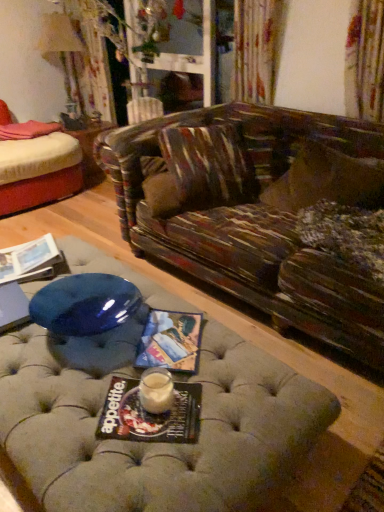
Describe the element at coordinates (89, 148) in the screenshot. This screenshot has height=512, width=384. I see `wooden side table at center` at that location.

Measure the distance between matte paper magazine at lower left, marked as the 1th magazine in a left-to-right arrangement, and camera.

matte paper magazine at lower left, marked as the 1th magazine in a left-to-right arrangement, and camera are 5.66 feet apart from each other.

Find the location of a particular element. This screenshot has width=384, height=512. fluffy brown pillow at right is located at coordinates (327, 180).

Between matte cream lampshade at upper left and matte black magazine at center, the third magazine when ordered from back to front, which one has smaller width?

matte black magazine at center, the third magazine when ordered from back to front.

Considering their positions, is matte cream lampshade at upper left located in front of or behind matte black magazine at center, arranged as the third magazine when viewed from the top?

Clearly, matte cream lampshade at upper left is behind matte black magazine at center, arranged as the third magazine when viewed from the top.

From the image's perspective, is matte cream lampshade at upper left located above or below matte black magazine at center, arranged as the third magazine when viewed from the top?

matte cream lampshade at upper left is above matte black magazine at center, arranged as the third magazine when viewed from the top.

Is matte cream lampshade at upper left far away from matte black magazine at center, which is the first magazine from front to back?

Indeed, matte cream lampshade at upper left is not near matte black magazine at center, which is the first magazine from front to back.

Which is in front, point (75, 40) or point (171, 339)?

Positioned in front is point (171, 339).

Is matte cream lampshade at upper left taller or shorter than matte paper magazine at center, acting as the 1th magazine starting from the right?

matte cream lampshade at upper left is taller than matte paper magazine at center, acting as the 1th magazine starting from the right.

Which of these two, matte cream lampshade at upper left or matte paper magazine at center, the 2th magazine in the bottom-to-top sequence, is smaller?

Smaller between the two is matte paper magazine at center, the 2th magazine in the bottom-to-top sequence.

Which object is wider, wooden side table at center or matte paper magazine at lower left, marked as the 1th magazine in a left-to-right arrangement?

wooden side table at center is wider.

The height and width of the screenshot is (512, 384). I want to click on magazine that is the 1st object located below the wooden side table at center (from the image's perspective), so click(x=28, y=258).

From a real-world perspective, is wooden side table at center beneath matte paper magazine at lower left, the 3th magazine ordered from the bottom?

Yes, from a real-world perspective, wooden side table at center is below matte paper magazine at lower left, the 3th magazine ordered from the bottom.

Between wooden side table at center and matte paper magazine at lower left, which is the first magazine from top to bottom, which one is positioned in front?

matte paper magazine at lower left, which is the first magazine from top to bottom, is in front.

From the image's perspective, which one is positioned higher, matte paper magazine at center, acting as the 1th magazine starting from the right, or wooden side table at center?

wooden side table at center, from the image's perspective.

Based on the photo, is matte paper magazine at center, the second magazine viewed from the front, oriented away from wooden side table at center?

Absolutely, matte paper magazine at center, the second magazine viewed from the front, is directed away from wooden side table at center.

Where is `side table above the matte paper magazine at center, which is the 3th magazine from left to right (from the image's perspective)`? This screenshot has height=512, width=384. side table above the matte paper magazine at center, which is the 3th magazine from left to right (from the image's perspective) is located at coordinates (89, 148).

Based on the photo, how many degrees apart are the facing directions of matte paper magazine at center, the 2th magazine in the bottom-to-top sequence, and wooden side table at center?

They differ by 51.7 degrees in their facing directions.

Looking at this image, which object is more forward, wooden side table at center or matte paper magazine at center, acting as the 1th magazine starting from the right?

matte paper magazine at center, acting as the 1th magazine starting from the right, is closer to the camera.

Is wooden side table at center located outside matte paper magazine at center, which ranks as the 2th magazine in top-to-bottom order?

Yes, wooden side table at center is located beyond the bounds of matte paper magazine at center, which ranks as the 2th magazine in top-to-bottom order.

From the image's perspective, which object appears higher, matte paper magazine at center, acting as the 1th magazine starting from the right, or fluffy brown pillow at right?

fluffy brown pillow at right appears higher in the image.

Considering the relative sizes of matte paper magazine at center, the second magazine viewed from the back, and fluffy brown pillow at right in the image provided, is matte paper magazine at center, the second magazine viewed from the back, shorter than fluffy brown pillow at right?

Yes, matte paper magazine at center, the second magazine viewed from the back, is shorter than fluffy brown pillow at right.

Between point (173, 320) and point (327, 164), which one is positioned behind?

Positioned behind is point (327, 164).

Considering the relative sizes of matte paper magazine at center, acting as the 1th magazine starting from the right, and fluffy brown pillow at right in the image provided, is matte paper magazine at center, acting as the 1th magazine starting from the right, wider than fluffy brown pillow at right?

No, matte paper magazine at center, acting as the 1th magazine starting from the right, is not wider than fluffy brown pillow at right.

Based on the photo, is fluffy brown pillow at right next to matte cream lampshade at upper left?

fluffy brown pillow at right and matte cream lampshade at upper left are not in contact.

From the image's perspective, is fluffy brown pillow at right above or below matte cream lampshade at upper left?

fluffy brown pillow at right is situated lower than matte cream lampshade at upper left in the image.

Looking at the image, does fluffy brown pillow at right seem bigger or smaller compared to matte cream lampshade at upper left?

Clearly, fluffy brown pillow at right is smaller in size than matte cream lampshade at upper left.

Find the location of `the 3rd magazine below the matte cream lampshade at upper left (from the image's perspective)`. the 3rd magazine below the matte cream lampshade at upper left (from the image's perspective) is located at coordinates (150, 414).

Starting from the matte cream lampshade at upper left, which magazine is the 2nd one in front? Please provide its 2D coordinates.

[(170, 341)]

Estimate the real-world distances between objects in this image. Which object is further from matte black magazine at center, acting as the 2th magazine starting from the left, wooden side table at center or matte paper magazine at center, which is the 3th magazine from left to right?

wooden side table at center is further to matte black magazine at center, acting as the 2th magazine starting from the left.

When comparing their distances from matte black magazine at center, which is the first magazine from front to back, does matte cream lampshade at upper left or matte paper magazine at center, acting as the 1th magazine starting from the right, seem further?

matte cream lampshade at upper left is further to matte black magazine at center, which is the first magazine from front to back.

Consider the image. Based on their spatial positions, is wooden side table at center or matte cream lampshade at upper left closer to matte black magazine at center, which appears as the second magazine when viewed from the right?

The object closer to matte black magazine at center, which appears as the second magazine when viewed from the right, is wooden side table at center.

When comparing their distances from matte black magazine at center, acting as the 2th magazine starting from the left, does matte cream lampshade at upper left or wooden side table at center seem further?

Among the two, matte cream lampshade at upper left is located further to matte black magazine at center, acting as the 2th magazine starting from the left.

When comparing their distances from matte black magazine at center, arranged as the third magazine when viewed from the top, does matte cream lampshade at upper left or fluffy brown pillow at right seem further?

matte cream lampshade at upper left is positioned further to the anchor matte black magazine at center, arranged as the third magazine when viewed from the top.

From the image, which object appears to be farther from fluffy brown pillow at right, matte black magazine at center, which is the first magazine from front to back, or matte paper magazine at center, the 2th magazine in the bottom-to-top sequence?

Based on the image, matte black magazine at center, which is the first magazine from front to back, appears to be further to fluffy brown pillow at right.

Looking at the image, which one is located further to matte black magazine at center, arranged as the third magazine when viewed from the top, matte paper magazine at lower left, the 3th magazine ordered from the bottom, or wooden side table at center?

Based on the image, wooden side table at center appears to be further to matte black magazine at center, arranged as the third magazine when viewed from the top.

Looking at the image, which one is located closer to matte paper magazine at lower left, which appears as the third magazine when viewed from the front, matte black magazine at center, arranged as the third magazine when viewed from the top, or matte paper magazine at center, the 2th magazine in the bottom-to-top sequence?

The object closer to matte paper magazine at lower left, which appears as the third magazine when viewed from the front, is matte paper magazine at center, the 2th magazine in the bottom-to-top sequence.

Where is `lamp between matte paper magazine at center, the second magazine viewed from the back, and wooden side table at center from front to back`? The image size is (384, 512). lamp between matte paper magazine at center, the second magazine viewed from the back, and wooden side table at center from front to back is located at coordinates (62, 51).

This screenshot has height=512, width=384. What are the coordinates of `side table between matte cream lampshade at upper left and fluffy brown pillow at right in the horizontal direction` in the screenshot? It's located at (89, 148).

Locate an element on the screen. The height and width of the screenshot is (512, 384). lamp located between matte paper magazine at lower left, the 3th magazine ordered from the bottom, and wooden side table at center in the depth direction is located at coordinates (62, 51).

Find the location of a particular element. pillow positioned between matte black magazine at center, which is the first magazine from bottom to top, and wooden side table at center from near to far is located at coordinates (327, 180).